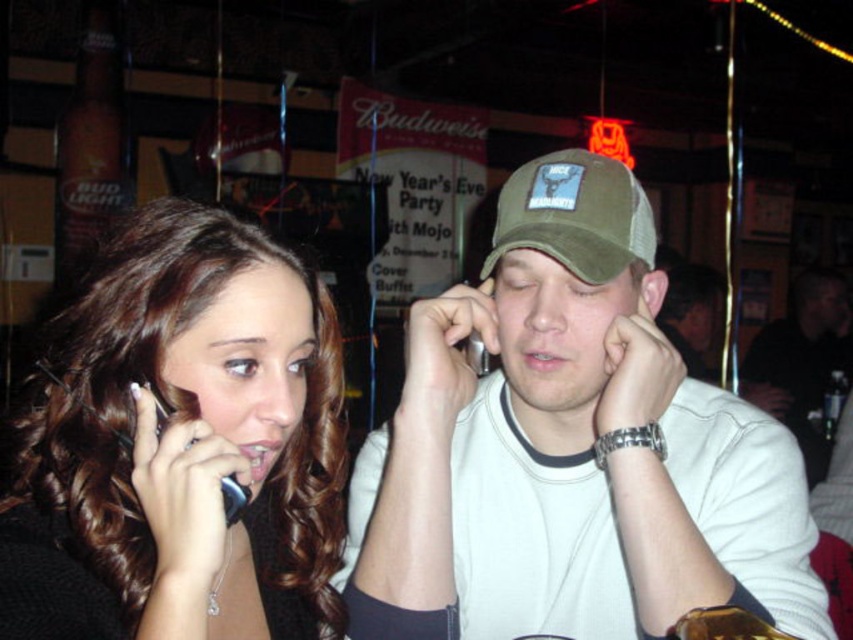
Is khaki fabric cap at center wider than shiny black phone at left?

Indeed, khaki fabric cap at center has a greater width compared to shiny black phone at left.

Find the location of a particular element. khaki fabric cap at center is located at coordinates (579, 445).

What do you see at coordinates (181, 445) in the screenshot?
I see `shiny black phone at left` at bounding box center [181, 445].

How far apart are shiny black phone at left and olive green mesh baseball cap at center?

shiny black phone at left is 12.87 inches away from olive green mesh baseball cap at center.

Locate an element on the screen. This screenshot has height=640, width=853. shiny black phone at left is located at coordinates (181, 445).

Does khaki fabric cap at center appear on the right side of olive green mesh baseball cap at center?

Yes, khaki fabric cap at center is to the right of olive green mesh baseball cap at center.

Which is above, khaki fabric cap at center or olive green mesh baseball cap at center?

Positioned higher is olive green mesh baseball cap at center.

I want to click on khaki fabric cap at center, so click(579, 445).